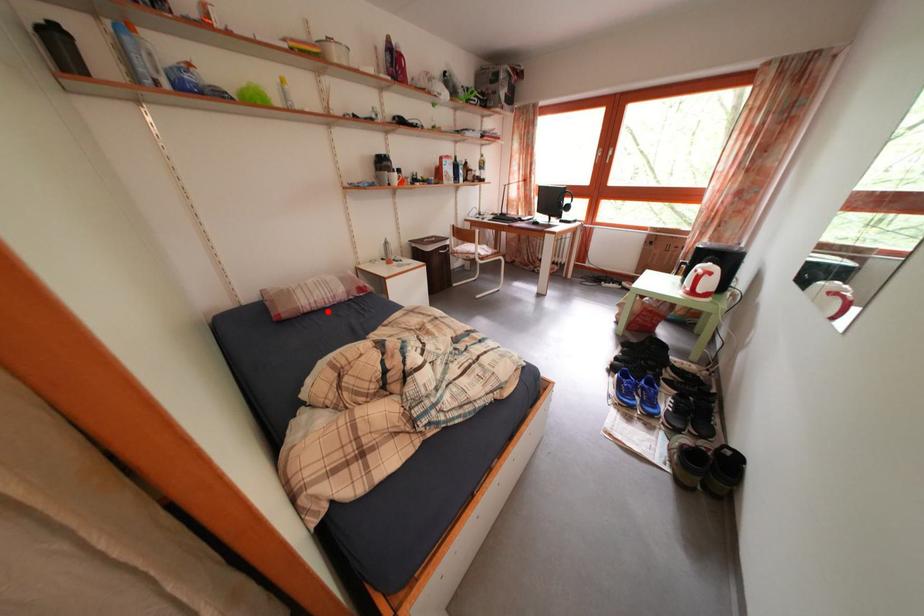
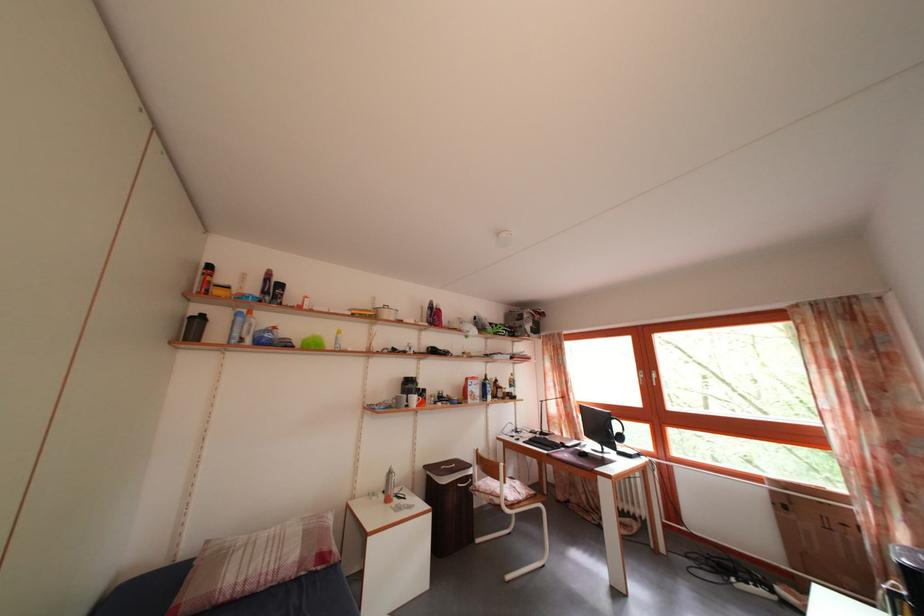
The point at the highlighted location is marked in the first image. Where is the corresponding point in the second image?

(257, 594)